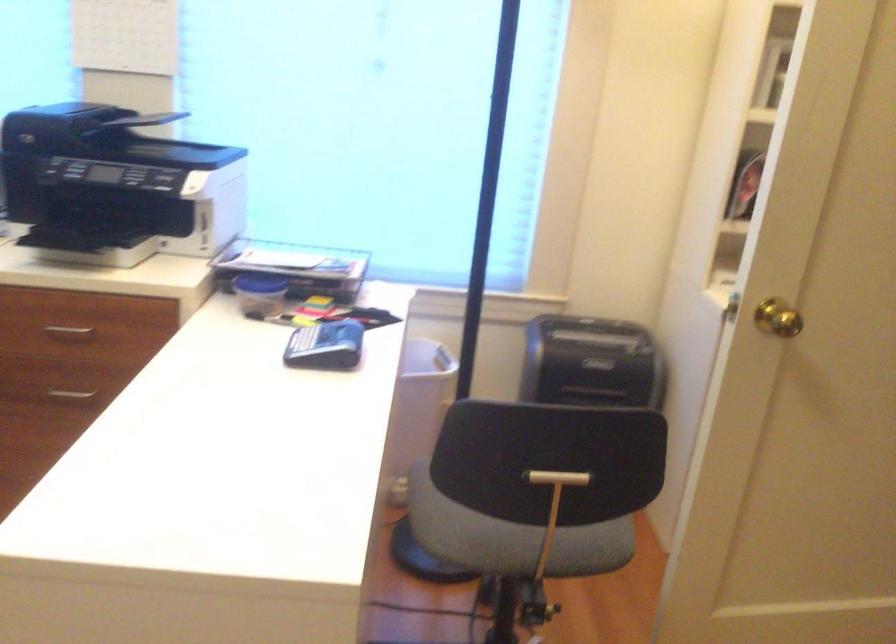
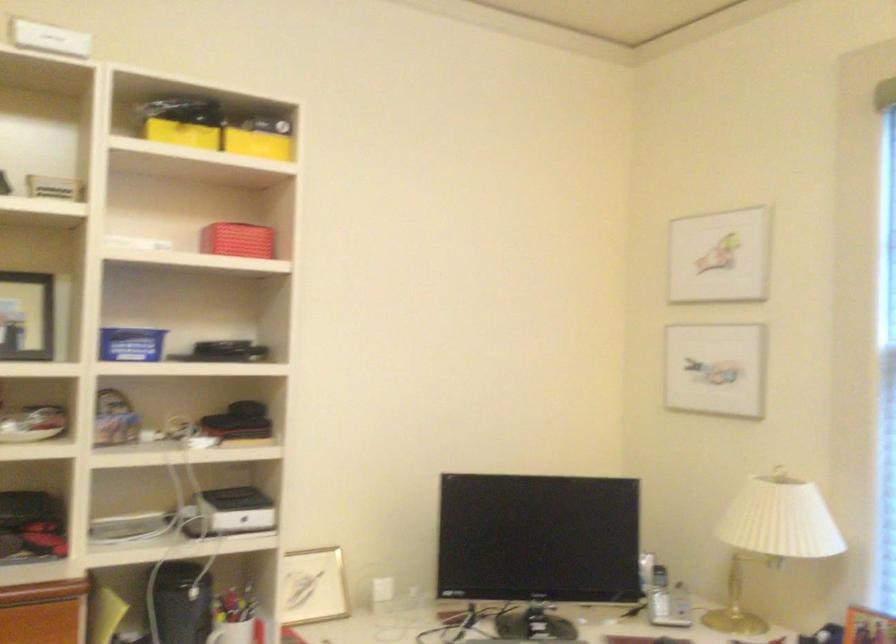
How did the camera likely rotate?

The camera rotated toward left-up.